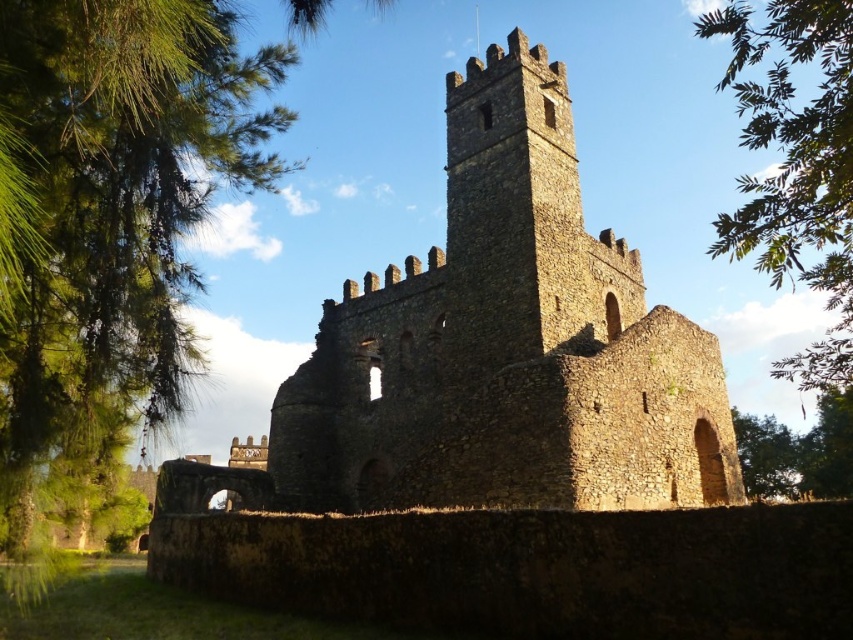
Who is more distant from viewer, (59, 29) or (773, 230)?

Positioned behind is point (773, 230).

Can you confirm if green leafy tree at upper left is thinner than green leafy tree at upper right?

Correct, green leafy tree at upper left's width is less than green leafy tree at upper right's.

Who is more forward, [19,65] or [757,205]?

Positioned in front is point [19,65].

Image resolution: width=853 pixels, height=640 pixels. Find the location of `green leafy tree at upper left`. green leafy tree at upper left is located at coordinates (109, 221).

Does green leafy tree at upper right have a lesser width compared to green leafy tree at lower right?

In fact, green leafy tree at upper right might be wider than green leafy tree at lower right.

Does green leafy tree at upper right lie behind green leafy tree at lower right?

No.

Measure the distance between green leafy tree at upper right and camera.

The distance of green leafy tree at upper right from camera is 44.31 meters.

Identify the location of green leafy tree at upper right. This screenshot has width=853, height=640. (795, 164).

Which is in front, point (672, 326) or point (747, 419)?

Point (672, 326)

Is brown stone tower at center taller than green leafy tree at lower right?

Indeed, brown stone tower at center has a greater height compared to green leafy tree at lower right.

Which is behind, point (323, 458) or point (747, 440)?

Point (747, 440)

Identify the location of brown stone tower at center. (506, 344).